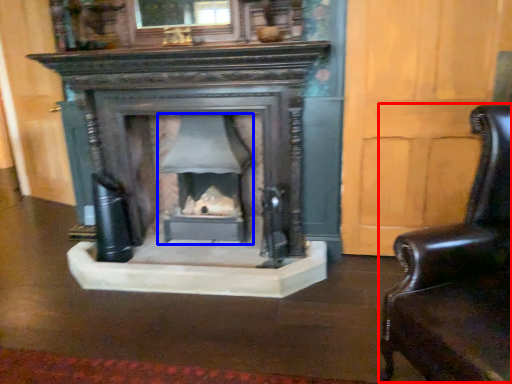
Question: Which of the following is the farthest to the observer, swivel chair (highlighted by a red box) or fireplace (highlighted by a blue box)?

Choices:
 (A) swivel chair
 (B) fireplace

Answer: (B)